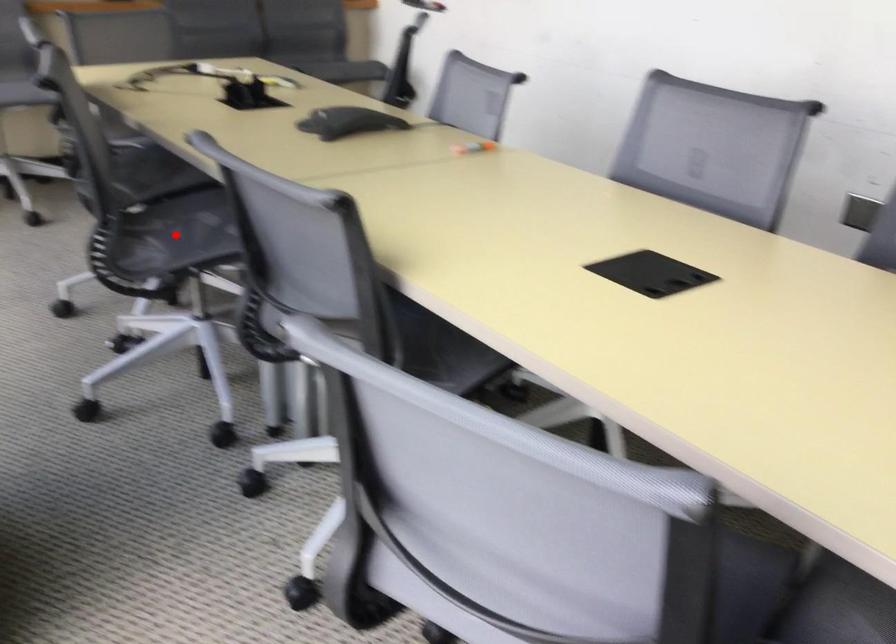
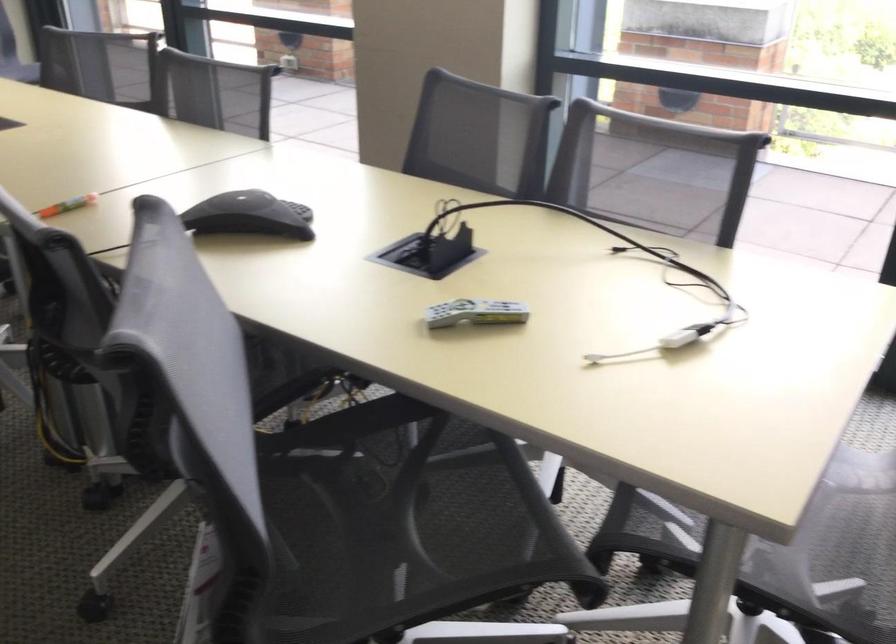
Question: I am providing you with two images of the same scene from different viewpoints. A red point is marked on the first image. At the location where the point appears in image 1, is it still visible in image 2?

Choices:
 (A) Yes
 (B) No

Answer: (B)